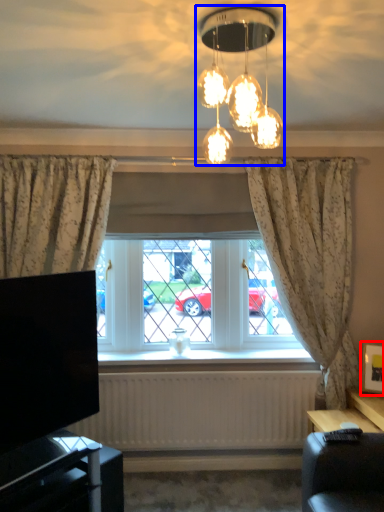
Question: Which point is closer to the camera, picture frame (highlighted by a red box) or lamp (highlighted by a blue box)?

Choices:
 (A) picture frame
 (B) lamp

Answer: (B)